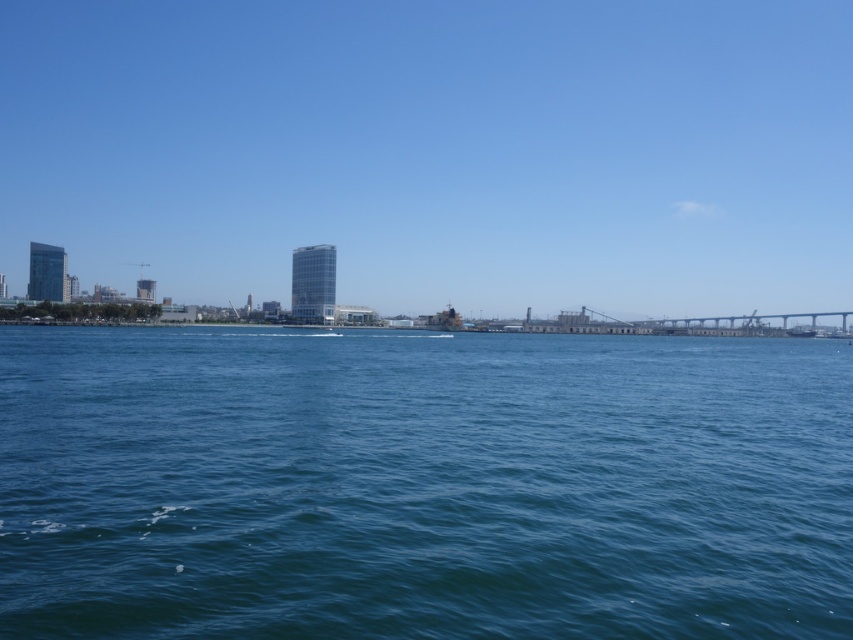
Which is below, blue water at center or transparent glass skyscraper at center?

Positioned lower is blue water at center.

Which of these two, blue water at center or transparent glass skyscraper at center, stands shorter?

With less height is blue water at center.

Identify the location of blue water at center. (422, 484).

Between transparent glass skyscraper at center and concrete gray bridge at right, which one is positioned lower?

concrete gray bridge at right

Between transparent glass skyscraper at center and concrete gray bridge at right, which one is positioned higher?

Positioned higher is transparent glass skyscraper at center.

Who is more forward, (x=175, y=269) or (x=581, y=326)?

Point (x=581, y=326) is in front.

This screenshot has height=640, width=853. I want to click on transparent glass skyscraper at center, so click(x=437, y=150).

Can you confirm if blue water at center is positioned below concrete gray bridge at right?

Yes, blue water at center is below concrete gray bridge at right.

Which is behind, point (733, 380) or point (576, 323)?

The point (576, 323) is more distant.

In order to click on blue water at center in this screenshot , I will do `click(422, 484)`.

Identify the location of blue water at center. (422, 484).